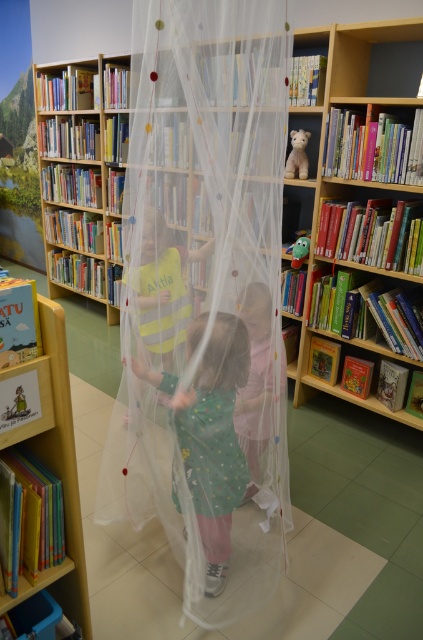
Question: Is yellow fabric dress at center bigger than green plush toy at upper center?

Choices:
 (A) yes
 (B) no

Answer: (A)

Question: Which object is positioned farthest from the pastel polka dot dress at center?

Choices:
 (A) transparent plastic bookcase at center
 (B) yellow cardboard bookshelf at lower left
 (C) white plush bear at upper center

Answer: (C)

Question: In this image, where is transparent plastic bookcase at center located relative to green plush toy at upper center?

Choices:
 (A) below
 (B) above

Answer: (B)

Question: Which of the following is the closest to the observer?

Choices:
 (A) white plush bear at upper center
 (B) polka dot fabric dress at center
 (C) pastel polka dot dress at center

Answer: (B)

Question: Among these objects, which one is farthest from the camera?

Choices:
 (A) green plush toy at upper center
 (B) white plush bear at upper center

Answer: (A)

Question: Where is wooden bookshelf at right located in relation to yellow cardboard bookshelf at lower left in the image?

Choices:
 (A) left
 (B) right

Answer: (B)